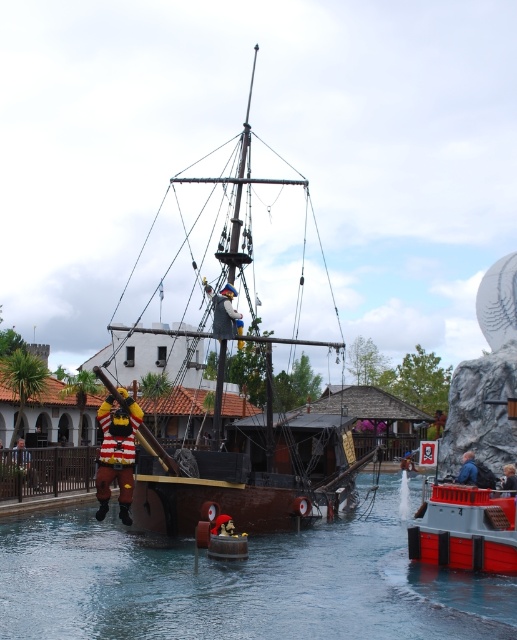
Question: Is brown wooden waterway at center wider than wooden pirate ship at center?

Choices:
 (A) no
 (B) yes

Answer: (B)

Question: Which object appears closest to the camera in this image?

Choices:
 (A) brown wooden waterway at center
 (B) wooden pirate ship at center

Answer: (A)

Question: In this image, where is brown wooden waterway at center located relative to wooden pirate ship at center?

Choices:
 (A) above
 (B) below

Answer: (B)

Question: Does brown wooden waterway at center come in front of wooden pirate ship at center?

Choices:
 (A) no
 (B) yes

Answer: (B)